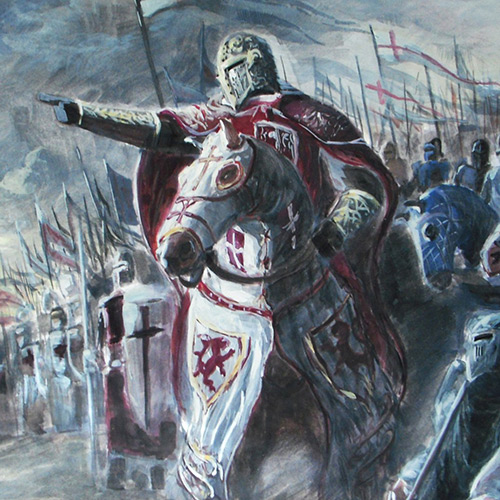
This screenshot has height=500, width=500. Identify the location of lower right corner of artwork. (497, 497).